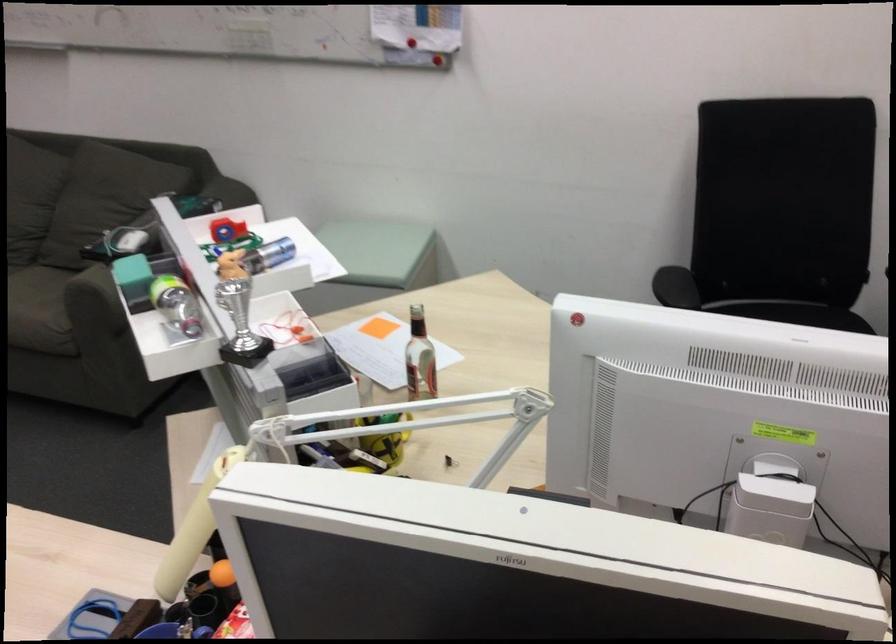
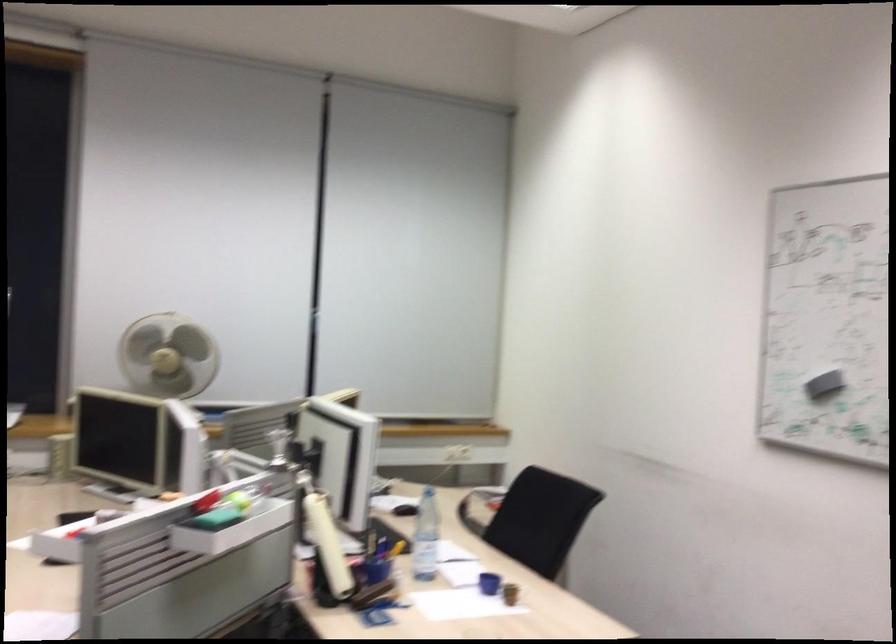
Question: I am providing you with two images of the same scene from different viewpoints. Please identify which objects are invisible in image2.

Choices:
 (A) yellow pen holder
 (B) chair sitting surface
 (C) blue cup
 (D) skylight handle

Answer: (A)